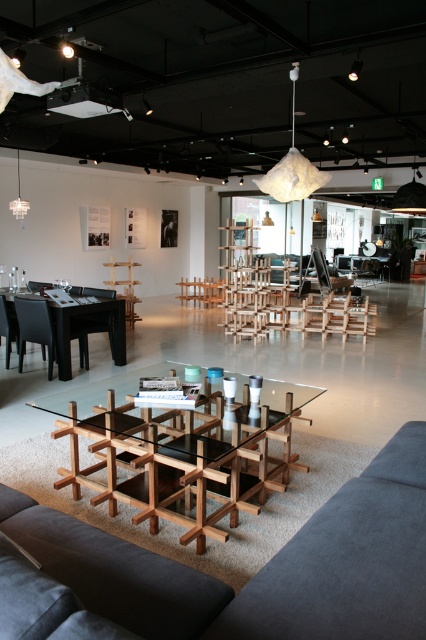
Question: Considering the real-world distances, which object is farthest from the wooden chair at left?

Choices:
 (A) velvet dark grey couch at lower center
 (B) wooden grid table at center
 (C) black glossy table at left

Answer: (A)

Question: Can you confirm if velvet dark grey couch at lower center is positioned below wooden chair at left?

Choices:
 (A) yes
 (B) no

Answer: (A)

Question: Can you confirm if black glossy table at left is wider than wooden chair at left?

Choices:
 (A) no
 (B) yes

Answer: (B)

Question: Among these points, which one is nearest to the camera?

Choices:
 (A) (117, 378)
 (B) (68, 378)
 (C) (86, 540)
 (D) (92, 298)

Answer: (C)

Question: Which object is closer to the camera taking this photo?

Choices:
 (A) wooden chair at left
 (B) black glossy table at left
 (C) wooden grid table at center
 (D) velvet dark grey couch at lower center

Answer: (D)

Question: Observing the image, what is the correct spatial positioning of velvet dark grey couch at lower center in reference to wooden chair at left?

Choices:
 (A) above
 (B) below

Answer: (B)